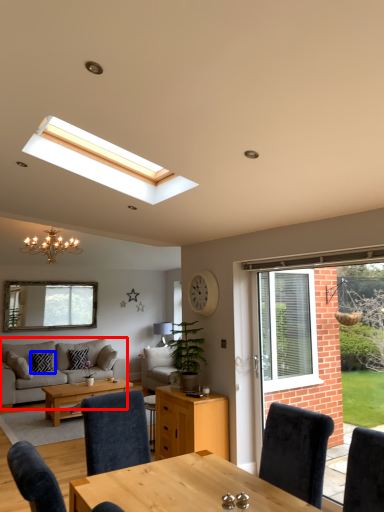
Question: Which object appears closest to the camera in this image, studio couch (highlighted by a red box) or pillow (highlighted by a blue box)?

Choices:
 (A) studio couch
 (B) pillow

Answer: (A)